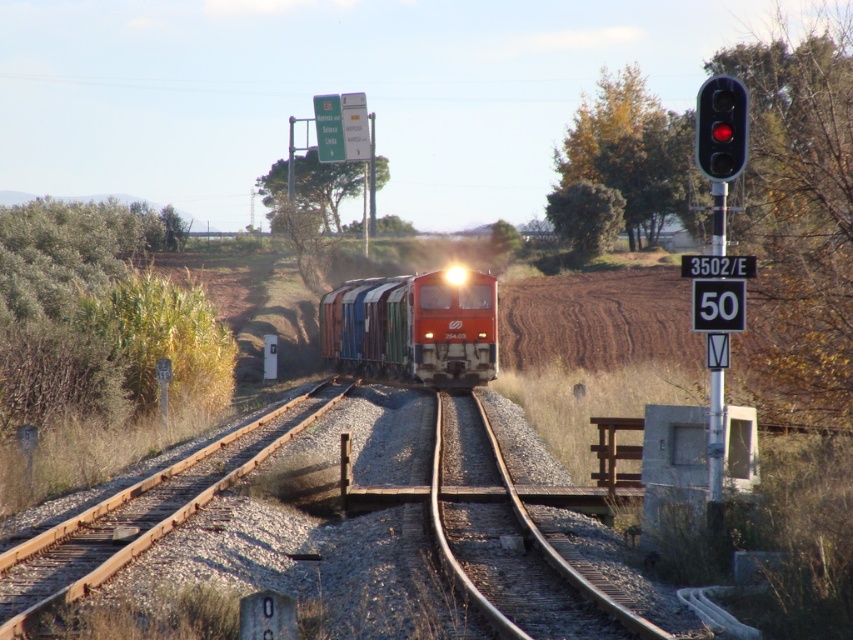
Which is below, green leafy tree at upper center or green leafy tree at center?

Positioned lower is green leafy tree at center.

Does green leafy tree at upper center appear on the right side of green leafy tree at center?

In fact, green leafy tree at upper center is to the left of green leafy tree at center.

I want to click on green leafy tree at upper center, so click(x=325, y=186).

Who is positioned more to the left, green leafy tree at upper center or red glass traffic light at upper right?

green leafy tree at upper center

Between green leafy tree at upper center and red glass traffic light at upper right, which one has less height?

red glass traffic light at upper right is shorter.

The height and width of the screenshot is (640, 853). What do you see at coordinates (325, 186) in the screenshot?
I see `green leafy tree at upper center` at bounding box center [325, 186].

At what (x,y) coordinates should I click in order to perform the action: click on green leafy tree at upper center. Please return your answer as a coordinate pair (x, y). Looking at the image, I should click on (325, 186).

Is yellow-green foliage at upper center bigger than green leafy tree at upper center?

Yes.

Can you confirm if yellow-green foliage at upper center is wider than green leafy tree at upper center?

Incorrect, yellow-green foliage at upper center's width does not surpass green leafy tree at upper center's.

Which is in front, point (679, 124) or point (277, 179)?

Point (679, 124) is in front.

Where is `yellow-green foliage at upper center`? yellow-green foliage at upper center is located at coordinates (630, 150).